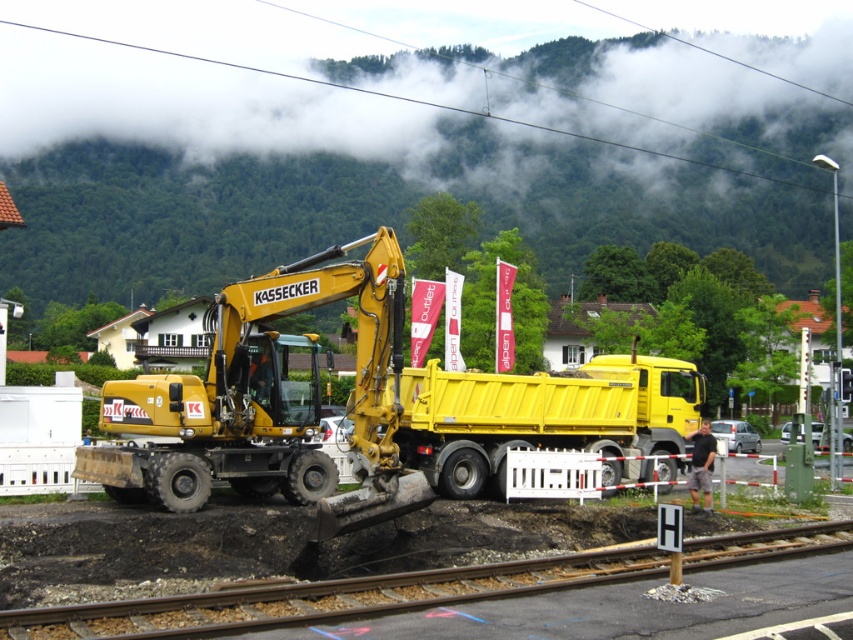
Between yellow matte trailer truck at center and smooth asphalt track at lower center, which one is positioned lower?

smooth asphalt track at lower center is lower down.

Can you confirm if yellow matte trailer truck at center is bigger than smooth asphalt track at lower center?

Yes.

Does point (601, 451) come farther from viewer compared to point (68, 618)?

Yes.

This screenshot has height=640, width=853. I want to click on yellow matte trailer truck at center, so click(547, 419).

Is point (380, 291) closer to viewer compared to point (737, 554)?

No, it is behind (737, 554).

Who is positioned more to the right, yellow rubber excavator at center or smooth asphalt track at lower center?

smooth asphalt track at lower center is more to the right.

Where is `yellow rubber excavator at center`? yellow rubber excavator at center is located at coordinates (264, 396).

The image size is (853, 640). Find the location of `yellow rubber excavator at center`. yellow rubber excavator at center is located at coordinates (264, 396).

Measure the distance from yellow rubber excavator at center to yellow matte trailer truck at center.

yellow rubber excavator at center and yellow matte trailer truck at center are 4.35 meters apart from each other.

Can you confirm if yellow rubber excavator at center is smaller than yellow matte trailer truck at center?

Indeed, yellow rubber excavator at center has a smaller size compared to yellow matte trailer truck at center.

Find the location of a particular element. This screenshot has height=640, width=853. yellow rubber excavator at center is located at coordinates (264, 396).